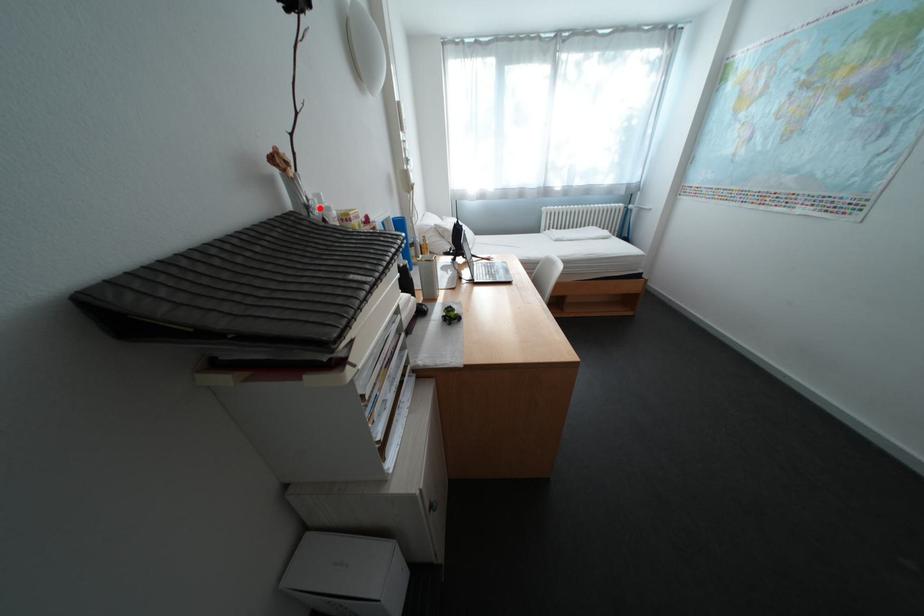
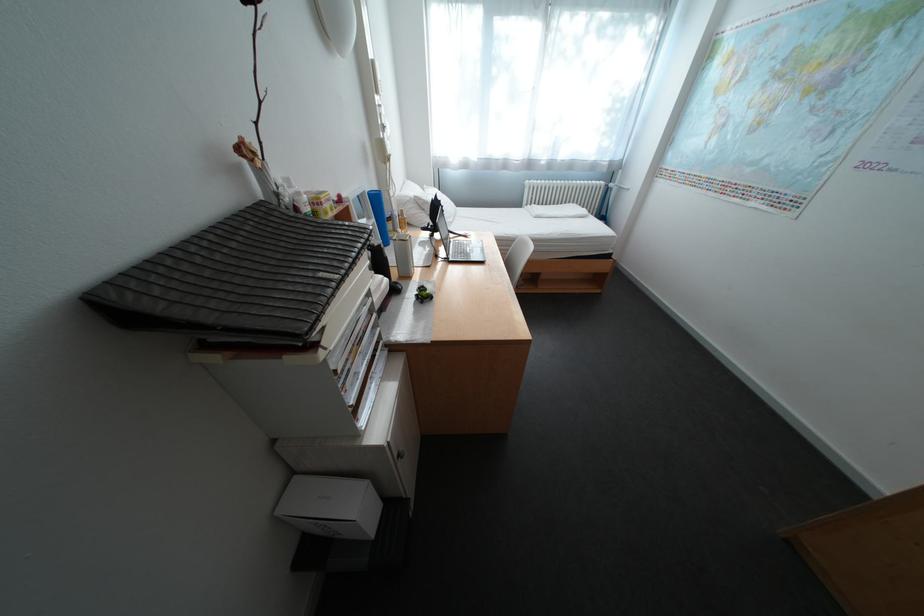
Where in the second image is the point corresponding to the highlighted location from the first image?

(290, 196)